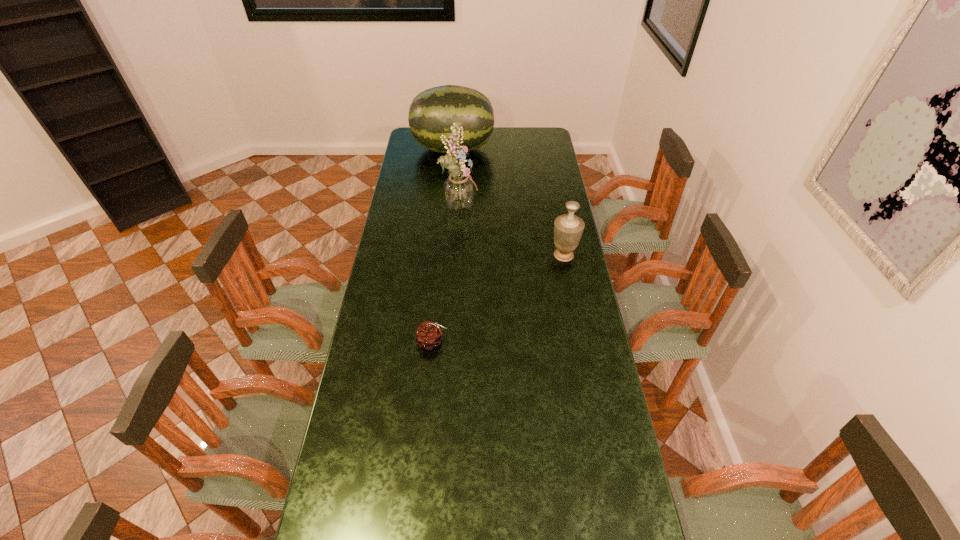
You are a GUI agent. You are given a task and a screenshot of the screen. Output one action in this format:
    pyautogui.click(x=<x>, y=<y>)
    Task: Click on the vacant point located between the tallest object and the shortest object
    The height and width of the screenshot is (540, 960).
    Given the screenshot: What is the action you would take?
    pyautogui.click(x=446, y=274)

Locate an element on the screen. free area in between the third shortest object and the rightmost object is located at coordinates (508, 202).

This screenshot has height=540, width=960. In order to click on vacant space that's between the tallest object and the nearest object in this screenshot , I will do `click(446, 274)`.

Image resolution: width=960 pixels, height=540 pixels. In order to click on unoccupied area between the nearest object and the second tallest object in this screenshot , I will do `click(443, 246)`.

At what (x,y) coordinates should I click in order to perform the action: click on free point between the bouquet and the rightmost object. Please return your answer as a coordinate pair (x, y). Image resolution: width=960 pixels, height=540 pixels. Looking at the image, I should click on click(512, 231).

Find the location of a particular element. Image resolution: width=960 pixels, height=540 pixels. vacant space in between the pinecone and the tallest object is located at coordinates (446, 274).

The height and width of the screenshot is (540, 960). I want to click on free space between the third tallest object and the bouquet, so click(x=512, y=231).

Find the location of `the third closest object to the farthest object`. the third closest object to the farthest object is located at coordinates (429, 335).

The width and height of the screenshot is (960, 540). I want to click on the closest object to the bouquet, so click(432, 112).

Locate an element on the screen. This screenshot has width=960, height=540. free location that satisfies the following two spatial constraints: 1. on the front side of the farthest object; 2. on the right side of the second nearest object is located at coordinates (444, 255).